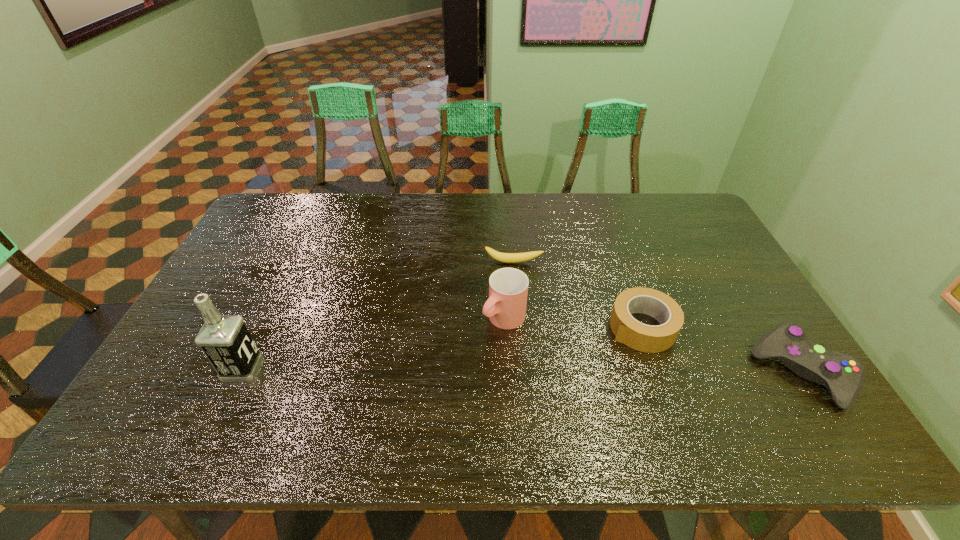
Image resolution: width=960 pixels, height=540 pixels. I want to click on vacant space on the desktop that is between the leftmost object and the control and is positioned at the edge of the duct tape, so [x=573, y=371].

Where is `vacant spot on the desktop that is between the tallest object and the third shortest object and is positioned on the upward curve of the farthest object`? The width and height of the screenshot is (960, 540). vacant spot on the desktop that is between the tallest object and the third shortest object and is positioned on the upward curve of the farthest object is located at coordinates (513, 370).

At what (x,y) coordinates should I click in order to perform the action: click on free spot on the desktop that is between the vodka and the control and is positioned on the side of the cup with the handle. Please return your answer as a coordinate pair (x, y). The image size is (960, 540). Looking at the image, I should click on (447, 370).